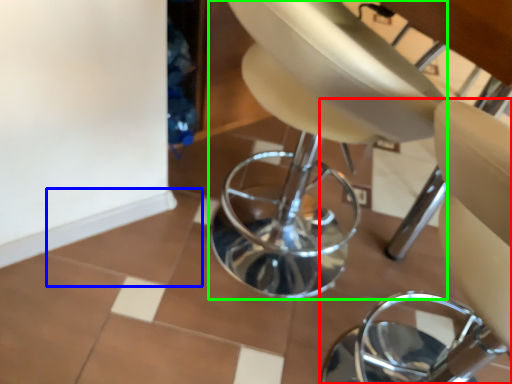
Question: Considering the real-world distances, which object is farthest from chair (highlighted by a red box)? ceramic tile (highlighted by a blue box) or swivel chair (highlighted by a green box)?

Choices:
 (A) ceramic tile
 (B) swivel chair

Answer: (A)